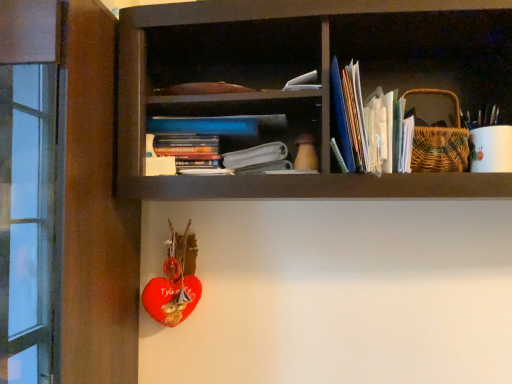
Question: Considering the relative sizes of white paper stack at upper right, the first book viewed from the right, and white paper at center in the image provided, is white paper stack at upper right, the first book viewed from the right, thinner than white paper at center?

Choices:
 (A) yes
 (B) no

Answer: (B)

Question: Can you confirm if white paper stack at upper right, the first book viewed from the right, is positioned to the right of white paper at center?

Choices:
 (A) no
 (B) yes

Answer: (B)

Question: Are white paper stack at upper right, placed as the second book when sorted from left to right, and white paper at center beside each other?

Choices:
 (A) no
 (B) yes

Answer: (A)

Question: From a real-world perspective, is white paper stack at upper right, placed as the second book when sorted from left to right, positioned under white paper at center based on gravity?

Choices:
 (A) no
 (B) yes

Answer: (A)

Question: From the image's perspective, is white paper stack at upper right, placed as the second book when sorted from left to right, located above white paper at center?

Choices:
 (A) no
 (B) yes

Answer: (B)

Question: Considering the positions of hardcover book at center, which is counted as the 2th book, starting from the right, and white paper at center in the image, is hardcover book at center, which is counted as the 2th book, starting from the right, wider or thinner than white paper at center?

Choices:
 (A) thin
 (B) wide

Answer: (A)

Question: Is hardcover book at center, which is counted as the 2th book, starting from the right, in front of or behind white paper at center in the image?

Choices:
 (A) front
 (B) behind

Answer: (B)

Question: Would you say hardcover book at center, which is counted as the 2th book, starting from the right, is to the left or to the right of white paper at center in the picture?

Choices:
 (A) left
 (B) right

Answer: (A)

Question: Is hardcover book at center, which is counted as the 2th book, starting from the right, inside or outside of white paper at center?

Choices:
 (A) outside
 (B) inside

Answer: (A)

Question: Visually, is hardcover book at center, which is counted as the 2th book, starting from the right, positioned to the left or to the right of white paper stack at upper right, placed as the second book when sorted from left to right?

Choices:
 (A) right
 (B) left

Answer: (B)

Question: In terms of size, does hardcover book at center, the first book in the left-to-right sequence, appear bigger or smaller than white paper stack at upper right, the first book viewed from the right?

Choices:
 (A) small
 (B) big

Answer: (A)

Question: From their relative heights in the image, would you say hardcover book at center, which is counted as the 2th book, starting from the right, is taller or shorter than white paper stack at upper right, placed as the second book when sorted from left to right?

Choices:
 (A) tall
 (B) short

Answer: (B)

Question: Is hardcover book at center, which is counted as the 2th book, starting from the right, wider or thinner than white paper stack at upper right, the first book viewed from the right?

Choices:
 (A) thin
 (B) wide

Answer: (A)

Question: Looking at the image, does white paper stack at upper right, the first book viewed from the right, seem bigger or smaller compared to hardcover book at center, which is counted as the 2th book, starting from the right?

Choices:
 (A) small
 (B) big

Answer: (B)

Question: Is white paper stack at upper right, placed as the second book when sorted from left to right, wider or thinner than hardcover book at center, the first book in the left-to-right sequence?

Choices:
 (A) wide
 (B) thin

Answer: (A)